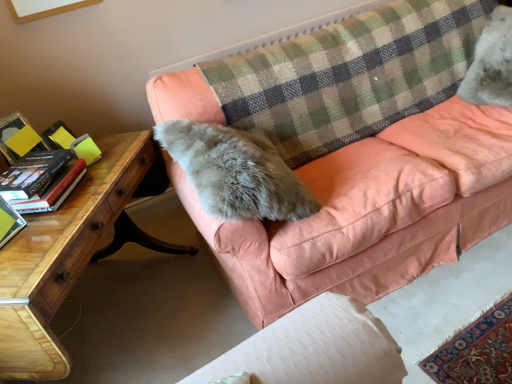
Question: Is wooden desk at lower left spatially inside peach velvet couch at center, or outside of it?

Choices:
 (A) inside
 (B) outside

Answer: (B)

Question: From the image's perspective, relative to peach velvet couch at center, is wooden desk at lower left above or below?

Choices:
 (A) below
 (B) above

Answer: (A)

Question: Based on their relative distances, which object is nearer to the white fluffy cat at upper right?

Choices:
 (A) checkered fabric plaid at upper center
 (B) peach velvet couch at center
 (C) hardcover book at left, marked as the 2th paperback book in a front-to-back arrangement
 (D) wooden desk at lower left
 (E) green matte book at left, positioned as the 1th paperback book in front-to-back order

Answer: (A)

Question: Which is nearer to the hardcover book at left, marked as the 2th paperback book in a front-to-back arrangement?

Choices:
 (A) checkered fabric plaid at upper center
 (B) wooden desk at lower left
 (C) white fluffy cat at upper right
 (D) peach velvet couch at center
 (E) green matte book at left, which ranks as the 2th paperback book in back-to-front order

Answer: (E)